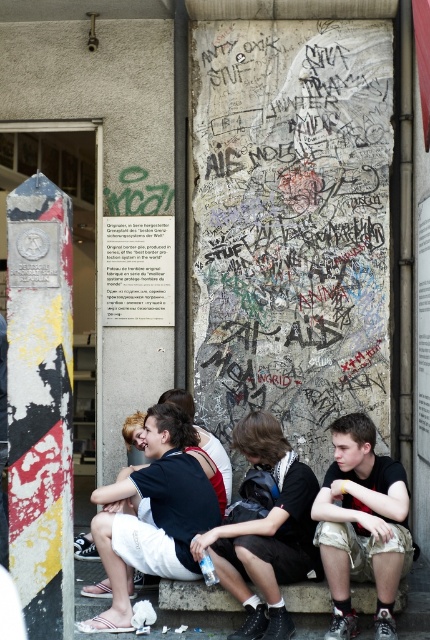
Question: Among these points, which one is nearest to the camera?

Choices:
 (A) [x=67, y=452]
 (B) [x=270, y=236]
 (C) [x=405, y=499]
 (D) [x=257, y=550]

Answer: (A)

Question: Does grungy concrete wall at center have a lesser width compared to dark gray fabric shorts at lower right?

Choices:
 (A) no
 (B) yes

Answer: (A)

Question: Observing the image, what is the correct spatial positioning of painted concrete post at left in reference to dark gray fabric shorts at lower right?

Choices:
 (A) above
 (B) below

Answer: (A)

Question: Is painted concrete post at left wider than dark gray fabric shorts at lower right?

Choices:
 (A) no
 (B) yes

Answer: (A)

Question: Which object is closer to the camera taking this photo?

Choices:
 (A) dark brown leather jacket at center
 (B) grungy concrete wall at center
 (C) dark gray fabric shorts at lower right

Answer: (C)

Question: Which of the following is the farthest from the observer?

Choices:
 (A) grungy concrete wall at center
 (B) dark gray fabric shorts at lower right

Answer: (A)